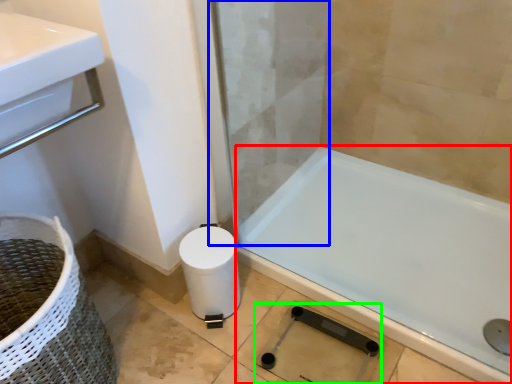
Question: Which is nearer to the bathtub (highlighted by a red box)? screen door (highlighted by a blue box) or shower (highlighted by a green box).

Choices:
 (A) screen door
 (B) shower

Answer: (B)